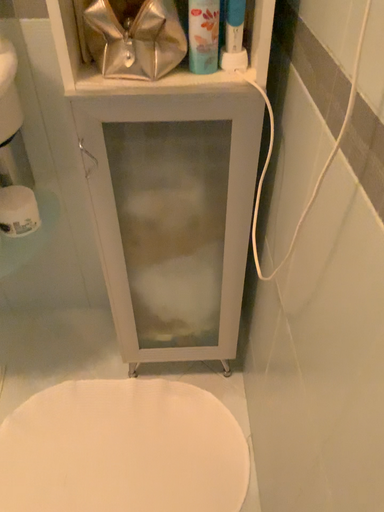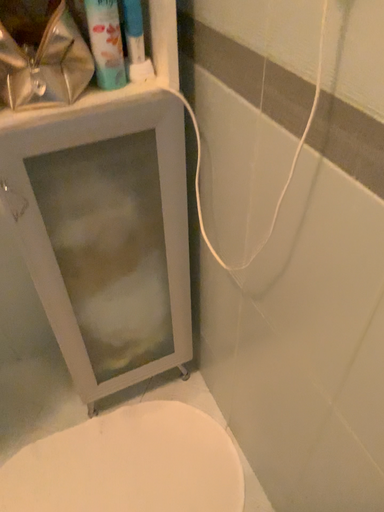
Question: Which way did the camera rotate in the video?

Choices:
 (A) rotated right
 (B) rotated left

Answer: (A)